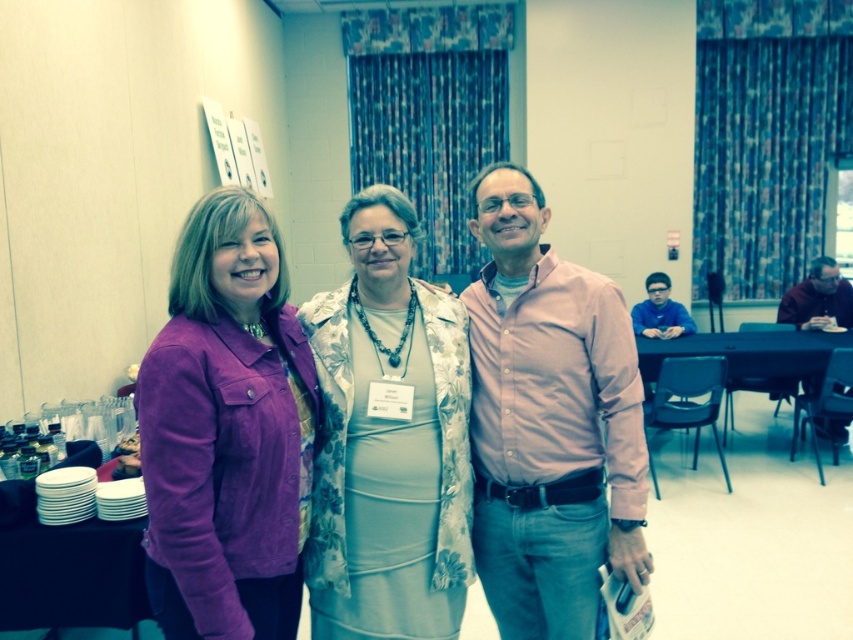
Question: Where is black plastic table at lower right located in relation to blue matte shirt at center in the image?

Choices:
 (A) left
 (B) right

Answer: (B)

Question: Which object is farther from the camera taking this photo?

Choices:
 (A) purple suede jacket at left
 (B) black plastic table at lower right
 (C) white plastic plates at lower left

Answer: (B)

Question: Which point is closer to the camera taking this photo?

Choices:
 (A) (752, 362)
 (B) (837, 308)
 (C) (518, 600)

Answer: (C)

Question: Is floral fabric dress at center behind white plastic plates at lower left?

Choices:
 (A) no
 (B) yes

Answer: (A)

Question: Is purple suede jacket at left thinner than floral fabric dress at center?

Choices:
 (A) no
 (B) yes

Answer: (B)

Question: Estimate the real-world distances between objects in this image. Which object is farther from the blue matte shirt at center?

Choices:
 (A) black plastic table at lower right
 (B) pink cotton shirt at right
 (C) purple suede jacket at left
 (D) white plastic plates at lower left

Answer: (C)